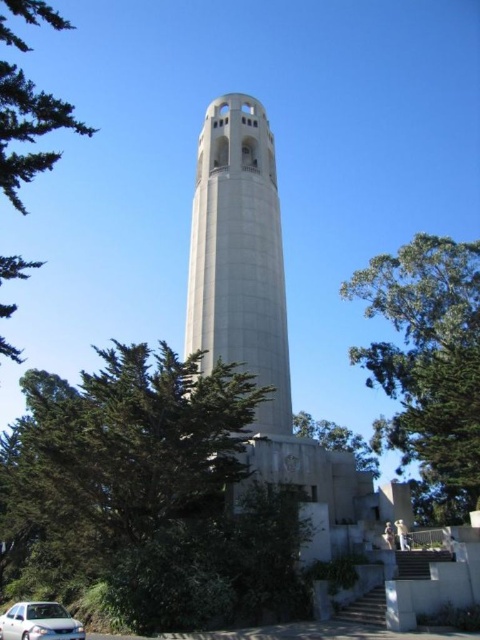
You are standing at the center of the image. Which direction should you look to see the green leafy tree at center?

The green leafy tree at center is located at point (151, 492), so you should look to the center of the image to see it.

You are a drone operator planning to fly a drone from the green leafy tree at left to the white concrete tower at center. The drone has a maximum flight range of 15 meters. Will the drone be able to reach the tower from the tree?

The white concrete tower at center is 16.45 meters away from the green leafy tree at left. Since the drone can only fly up to 15 meters, it will not be able to reach the tower from the tree.

You are standing in front of the tower and want to take a photo that includes both the green leafy tree at center and the green leafy tree at upper right. Which tree should you move closer to in order to include both in the frame without any obstruction?

You should move closer to the green leafy tree at center because it is in front of the green leafy tree at upper right, allowing both to be visible when positioned closer to the foreground tree.